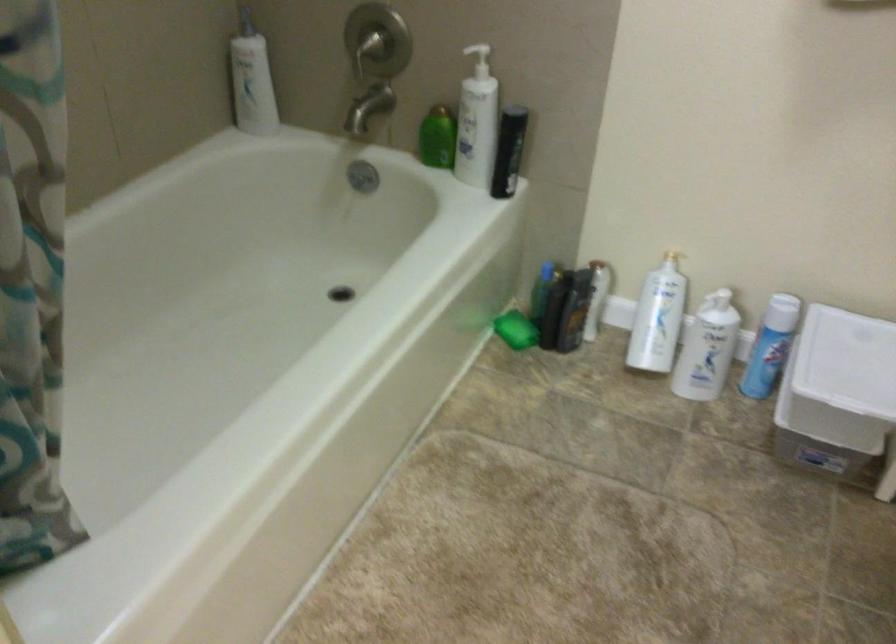
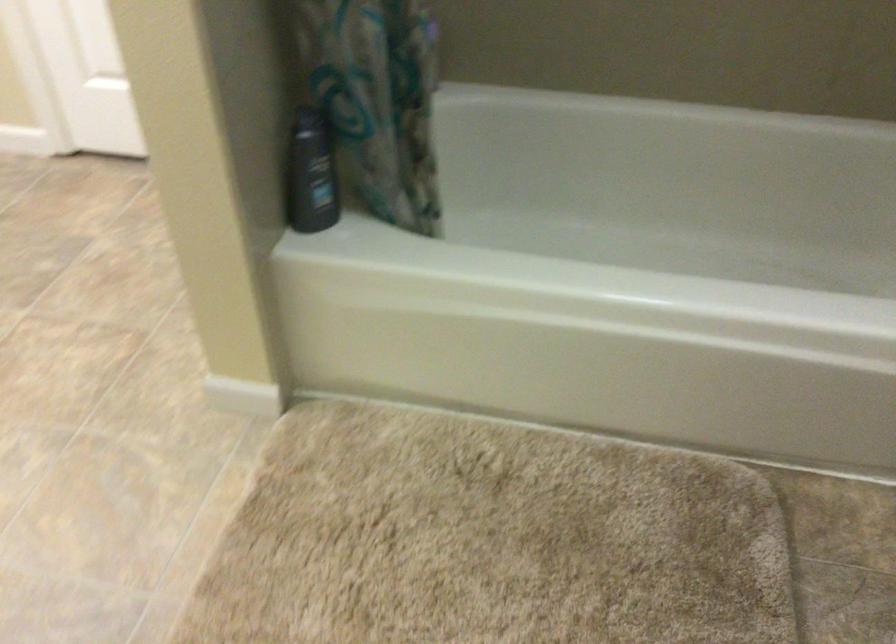
The first image is from the beginning of the video and the second image is from the end. How did the camera likely rotate when shooting the video?

Answer: The camera rotated toward left-down.